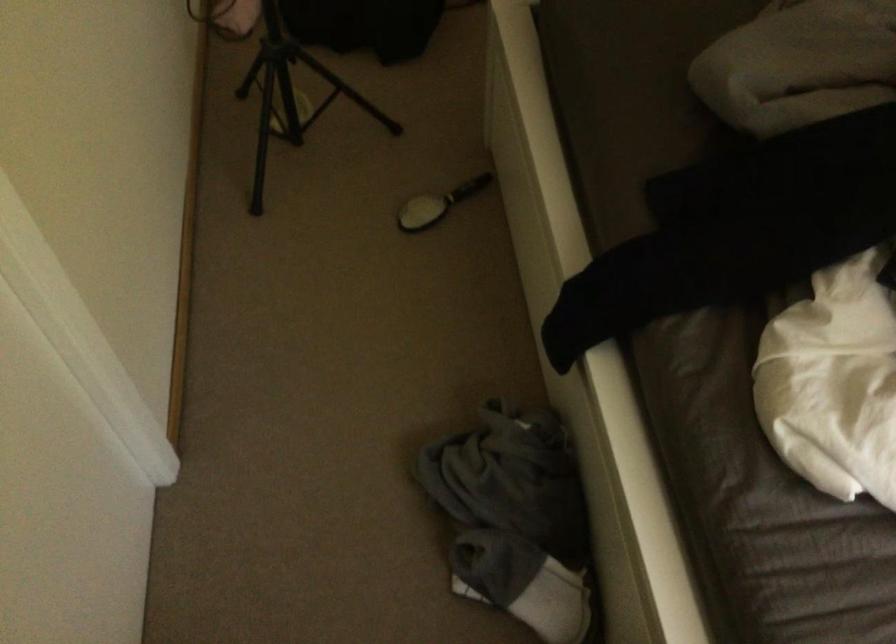
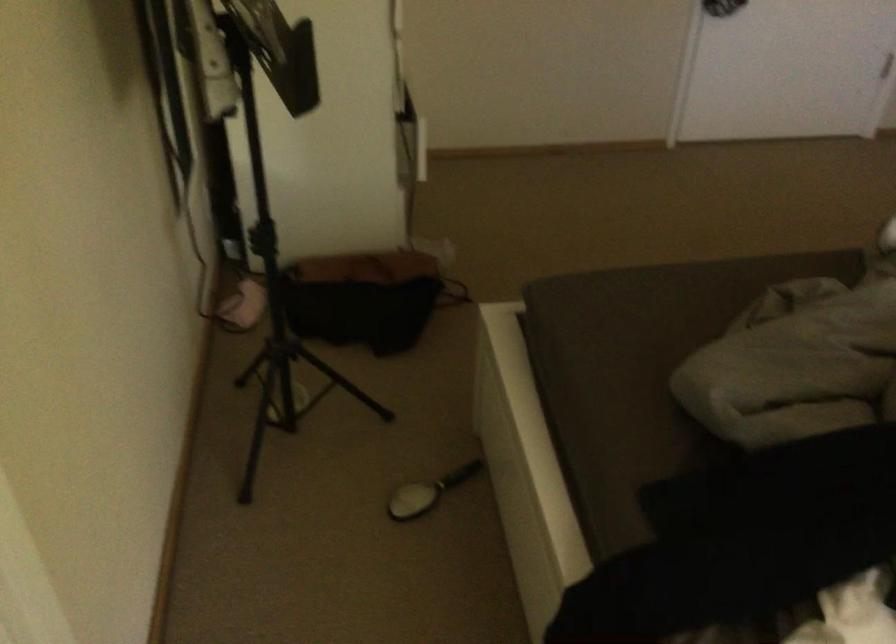
Question: Based on the continuous images, in which direction is the camera rotating? Reply with the corresponding letter.

Choices:
 (A) Left
 (B) Right
 (C) Up
 (D) Down

Answer: (C)